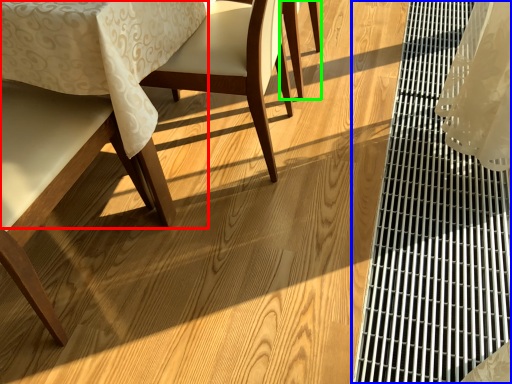
Question: Which object is the closest to the chair (highlighted by a red box)? Choose among these: table (highlighted by a blue box) or chair (highlighted by a green box).

Choices:
 (A) table
 (B) chair

Answer: (B)